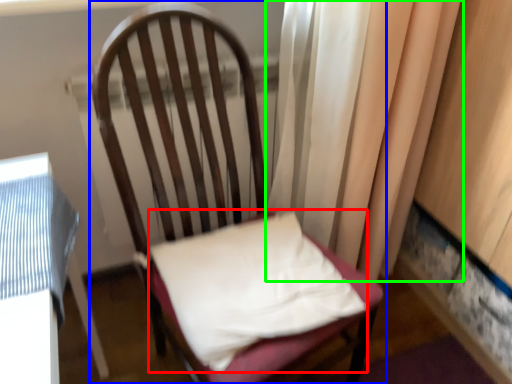
Question: Considering the real-world distances, which object is farthest from pillow (highlighted by a red box)? chair (highlighted by a blue box) or curtain (highlighted by a green box)?

Choices:
 (A) chair
 (B) curtain

Answer: (B)